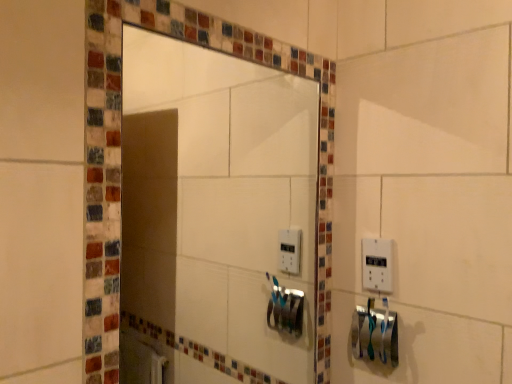
Question: Can you confirm if silver metallic towel bar at lower right is positioned to the right of matte glass mirror at center?

Choices:
 (A) yes
 (B) no

Answer: (A)

Question: Can you confirm if silver metallic towel bar at lower right is smaller than matte glass mirror at center?

Choices:
 (A) no
 (B) yes

Answer: (B)

Question: From a real-world perspective, is silver metallic towel bar at lower right on matte glass mirror at center?

Choices:
 (A) yes
 (B) no

Answer: (B)

Question: Is silver metallic towel bar at lower right wider than matte glass mirror at center?

Choices:
 (A) no
 (B) yes

Answer: (B)

Question: Is silver metallic towel bar at lower right directly adjacent to matte glass mirror at center?

Choices:
 (A) yes
 (B) no

Answer: (B)

Question: Is silver metallic towel bar at lower right in front of or behind matte glass mirror at center in the image?

Choices:
 (A) front
 (B) behind

Answer: (B)

Question: Is point (384, 347) positioned closer to the camera than point (161, 238)?

Choices:
 (A) farther
 (B) closer

Answer: (B)

Question: From a real-world perspective, is silver metallic towel bar at lower right positioned above or below matte glass mirror at center?

Choices:
 (A) below
 (B) above

Answer: (A)

Question: Considering the positions of silver metallic towel bar at lower right and matte glass mirror at center in the image, is silver metallic towel bar at lower right wider or thinner than matte glass mirror at center?

Choices:
 (A) wide
 (B) thin

Answer: (A)

Question: Does point (374, 256) appear closer or farther from the camera than point (373, 324)?

Choices:
 (A) closer
 (B) farther

Answer: (B)

Question: Relative to silver metallic towel bar at lower right, is white plastic light switch at right in front or behind?

Choices:
 (A) front
 (B) behind

Answer: (B)

Question: Looking at the image, does white plastic light switch at right seem bigger or smaller compared to silver metallic towel bar at lower right?

Choices:
 (A) big
 (B) small

Answer: (B)

Question: In the image, is white plastic light switch at right on the left side or the right side of silver metallic towel bar at lower right?

Choices:
 (A) right
 (B) left

Answer: (A)

Question: Based on their positions, is white plastic light switch at right located to the left or right of matte glass mirror at center?

Choices:
 (A) left
 (B) right

Answer: (B)

Question: Is point (369, 253) positioned closer to the camera than point (282, 334)?

Choices:
 (A) closer
 (B) farther

Answer: (A)